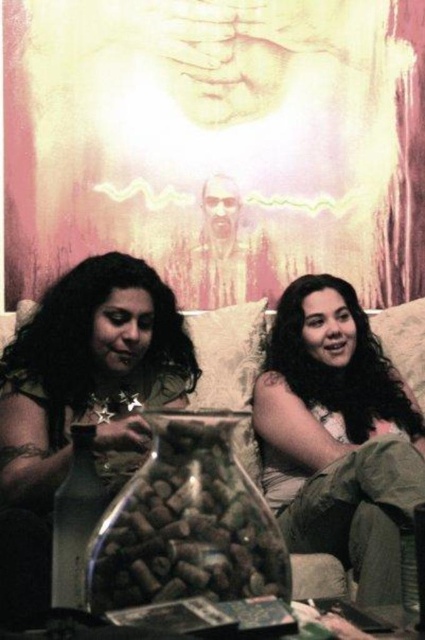
Is matte beige hair at center taller than matte gold bracelet at left?

Yes, matte beige hair at center is taller than matte gold bracelet at left.

Between point (382, 420) and point (40, 518), which one is positioned behind?

The point (382, 420) is more distant.

The image size is (425, 640). I want to click on matte beige hair at center, so click(337, 435).